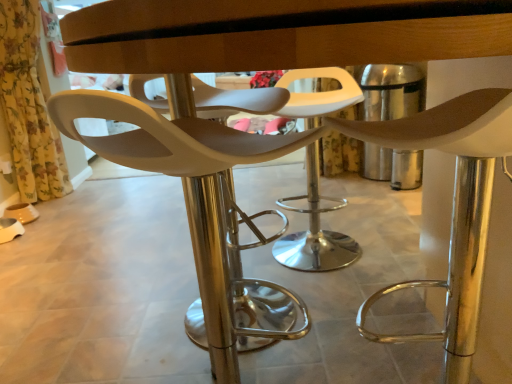
Question: Is matte white chair at center, acting as the second chair starting from the right, bigger or smaller than yellow floral fabric at left?

Choices:
 (A) big
 (B) small

Answer: (B)

Question: From the image's perspective, is matte white chair at center, acting as the second chair starting from the right, located above or below yellow floral fabric at left?

Choices:
 (A) below
 (B) above

Answer: (A)

Question: Based on their relative distances, which object is nearer to the yellow floral fabric at left?

Choices:
 (A) matte white chair at center, marked as the first chair in a right-to-left arrangement
 (B) matte white chair at center, acting as the second chair starting from the right

Answer: (B)

Question: Which object is the closest to the matte white chair at center, the second chair in the left-to-right sequence?

Choices:
 (A) matte white chair at center, acting as the second chair starting from the right
 (B) yellow floral fabric at left

Answer: (A)